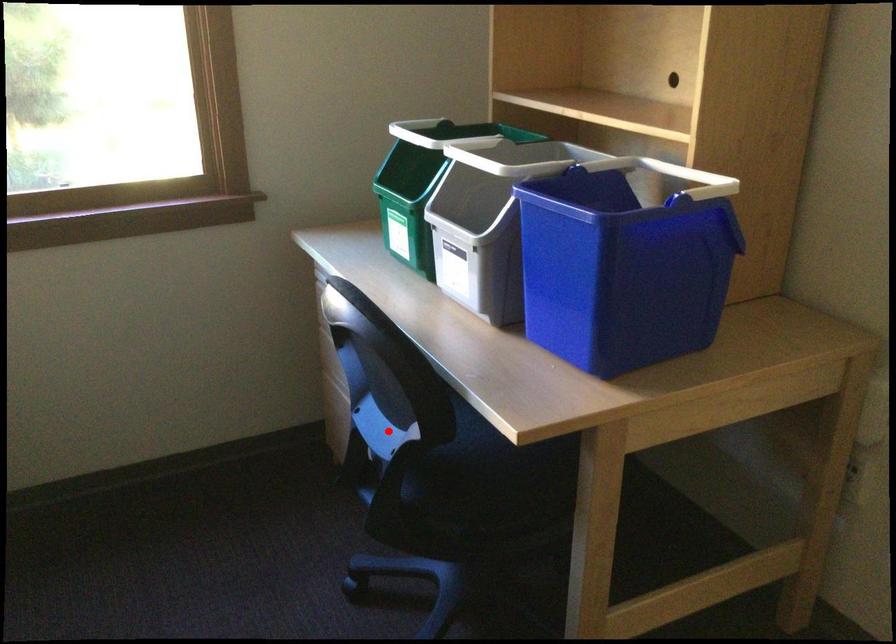
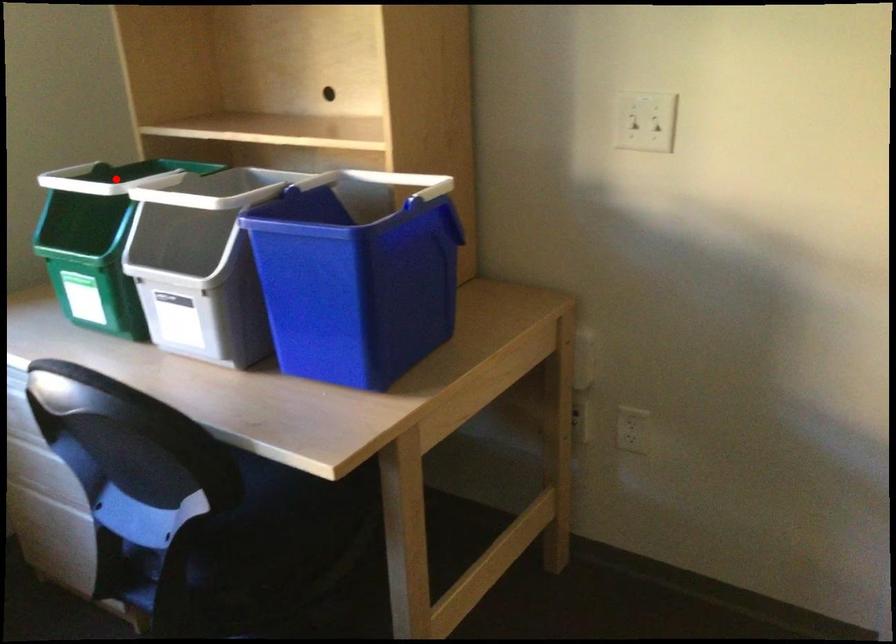
I am providing you with two images of the same scene from different viewpoints. A red point is marked on the first image and another point is marked on the second image. Do the highlighted points in image1 and image2 indicate the same real-world spot?

No